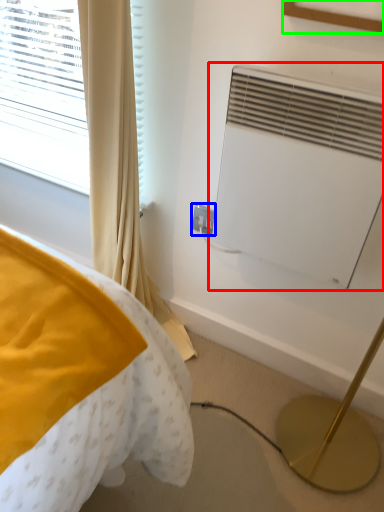
Question: Which object is positioned closest to air conditioning (highlighted by a red box)? Select from electric outlet (highlighted by a blue box) and picture frame (highlighted by a green box).

Choices:
 (A) electric outlet
 (B) picture frame

Answer: (B)